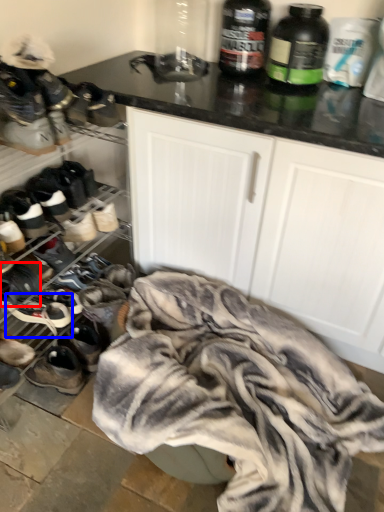
Question: Which object is further to the camera taking this photo, footwear (highlighted by a red box) or footwear (highlighted by a blue box)?

Choices:
 (A) footwear
 (B) footwear

Answer: (B)